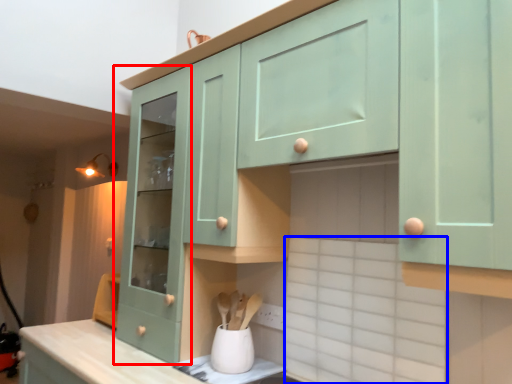
Question: Which object appears farthest to the camera in this image, cabinetry (highlighted by a red box) or ceramic tile (highlighted by a blue box)?

Choices:
 (A) cabinetry
 (B) ceramic tile

Answer: (A)